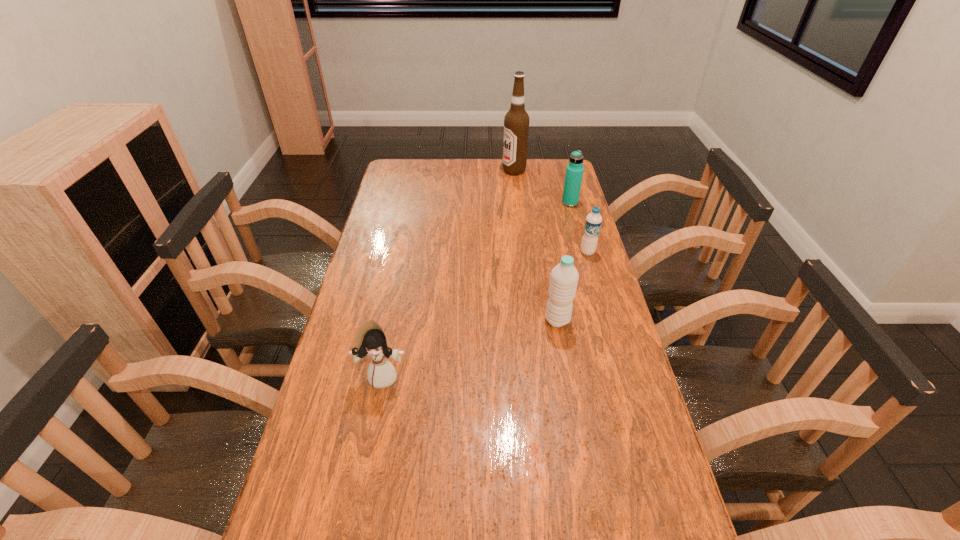
This screenshot has width=960, height=540. I want to click on object that stands as the third closest to the third nearest object, so click(516, 122).

This screenshot has height=540, width=960. Find the location of `water bottle that is the closest to the alcohol`. water bottle that is the closest to the alcohol is located at coordinates (574, 172).

The width and height of the screenshot is (960, 540). Identify the location of the third closest water bottle to the tallest object. (564, 278).

Locate an element on the screen. free space that satisfies the following two spatial constraints: 1. on the label of the tallest object; 2. on the left side of the fourth farthest object is located at coordinates (532, 320).

At what (x,y) coordinates should I click in order to perform the action: click on vacant space that satisfies the following two spatial constraints: 1. on the label of the farthest object; 2. at the front face of the nearest object. Please return your answer as a coordinate pair (x, y). This screenshot has height=540, width=960. Looking at the image, I should click on (539, 376).

At what (x,y) coordinates should I click in order to perform the action: click on free location that satisfies the following two spatial constraints: 1. on the label of the farthest object; 2. on the left side of the fourth farthest object. Please return your answer as a coordinate pair (x, y). Image resolution: width=960 pixels, height=540 pixels. Looking at the image, I should click on (532, 320).

Identify the location of vacant space that satisfies the following two spatial constraints: 1. on the back side of the farthest water bottle; 2. on the label of the farthest object. The height and width of the screenshot is (540, 960). (561, 171).

Find the location of `vacant space that satisfies the following two spatial constraints: 1. on the label of the farthest object; 2. at the front face of the leftmost object`. vacant space that satisfies the following two spatial constraints: 1. on the label of the farthest object; 2. at the front face of the leftmost object is located at coordinates (539, 376).